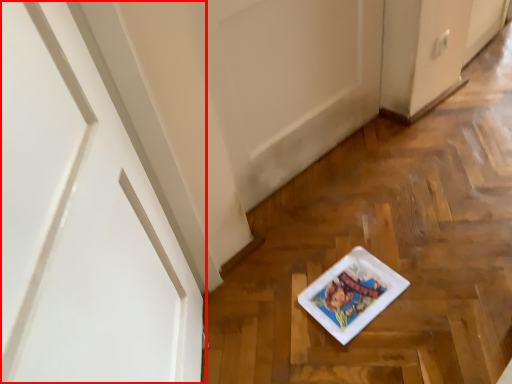
Question: In this image, where is door (annotated by the red box) located relative to platter?

Choices:
 (A) left
 (B) right

Answer: (A)